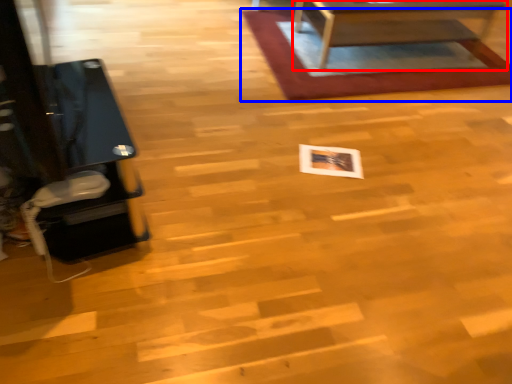
Question: Among these objects, which one is farthest to the camera, table (highlighted by a red box) or mat (highlighted by a blue box)?

Choices:
 (A) table
 (B) mat

Answer: (B)